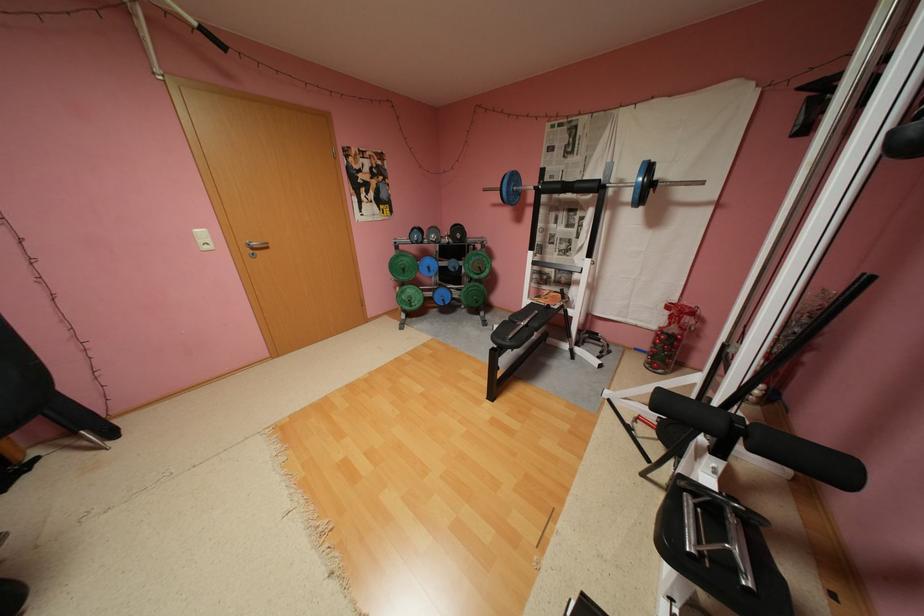
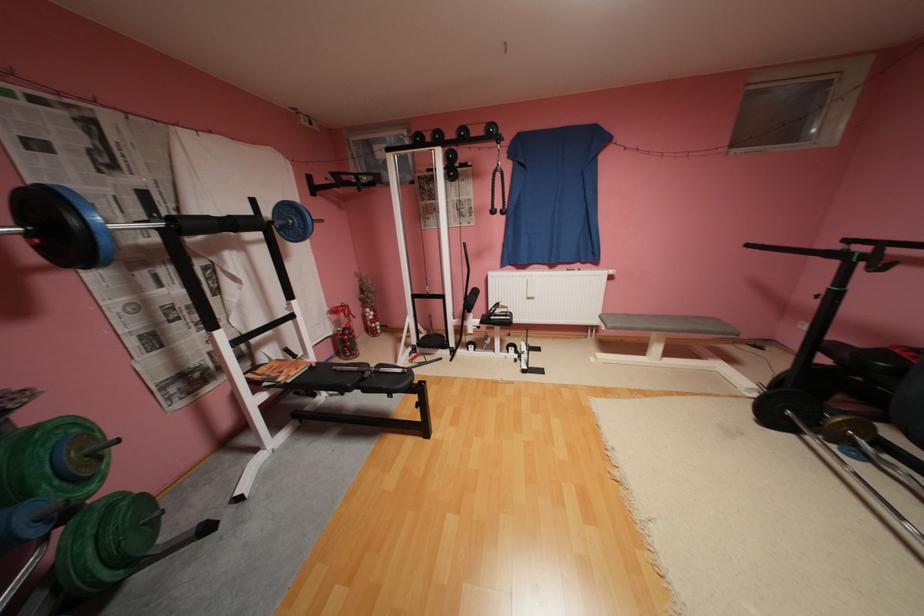
Locate, in the second image, the point that corresponds to (x=491, y=272) in the first image.

(111, 459)